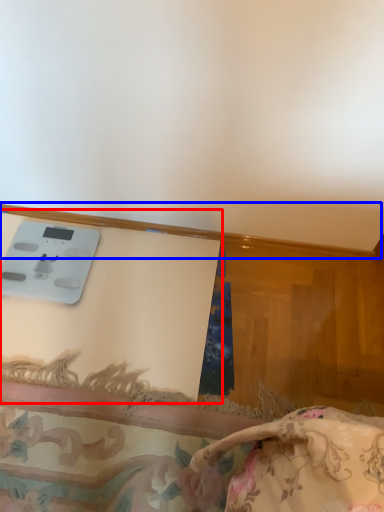
Question: Which point is further to the camera, table (highlighted by a red box) or trim (highlighted by a blue box)?

Choices:
 (A) table
 (B) trim

Answer: (B)